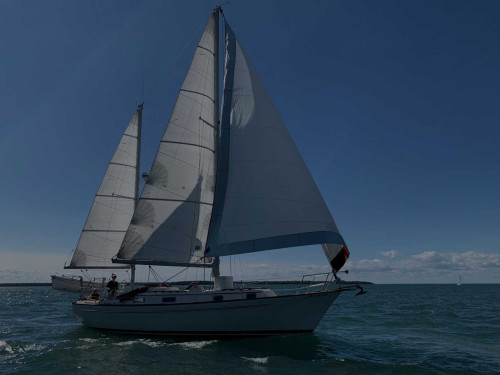
Find the location of a particular element. The height and width of the screenshot is (375, 500). pulpit is located at coordinates (352, 288).